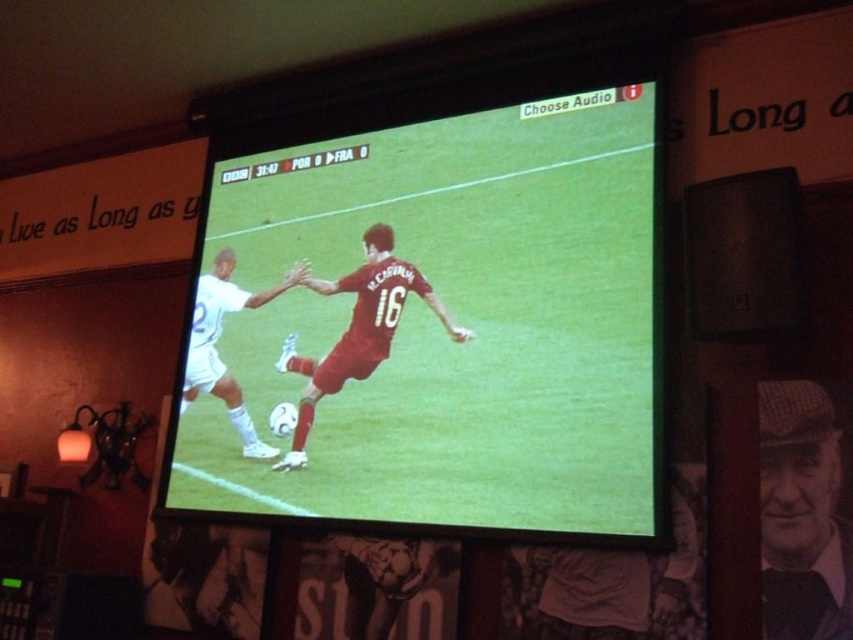
Question: Does red matte soccer player at center appear on the left side of white matte soccer player at center?

Choices:
 (A) yes
 (B) no

Answer: (B)

Question: Among these objects, which one is farthest from the camera?

Choices:
 (A) checkered fabric cap at right
 (B) red matte soccer player at center

Answer: (B)

Question: Can you confirm if matte red soccer ball at center is wider than white matte soccer player at center?

Choices:
 (A) yes
 (B) no

Answer: (A)

Question: Is red matte soccer player at center bigger than white matte soccer player at center?

Choices:
 (A) yes
 (B) no

Answer: (A)

Question: Among these points, which one is nearest to the camera?

Choices:
 (A) (357, 324)
 (B) (312, 289)
 (C) (811, 506)

Answer: (C)

Question: Which point is closer to the camera?

Choices:
 (A) white matte soccer player at center
 (B) checkered fabric cap at right
 (C) matte red soccer ball at center

Answer: (B)